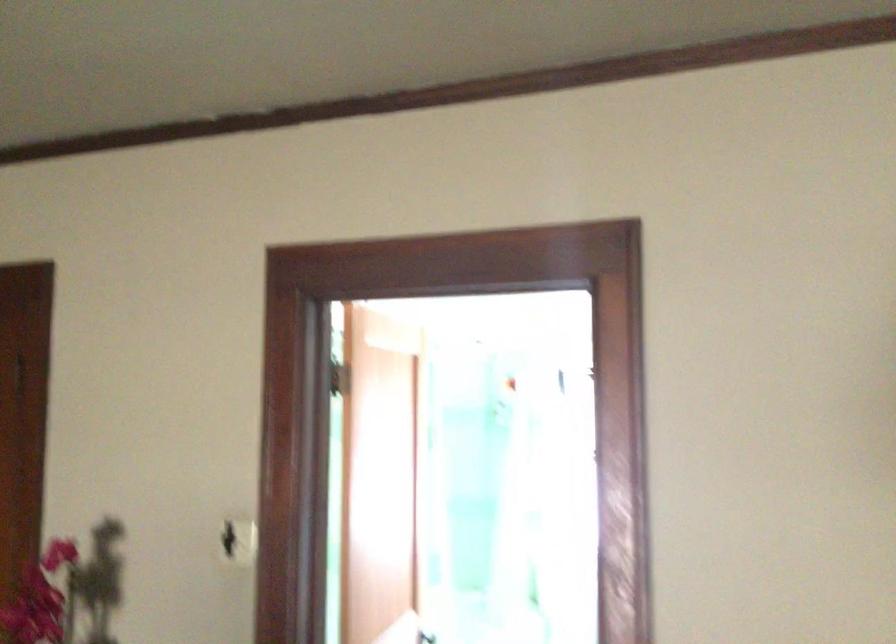
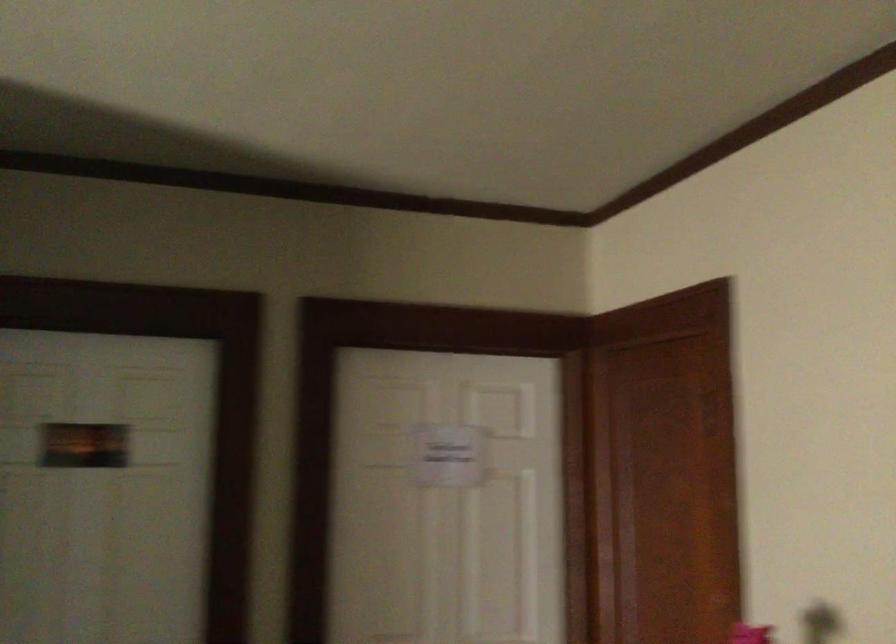
Question: The camera is either moving clockwise (left) or counter-clockwise (right) around the object. The first image is from the beginning of the video and the second image is from the end. Is the camera moving left or right when shooting the video?

Choices:
 (A) Left
 (B) Right

Answer: (B)